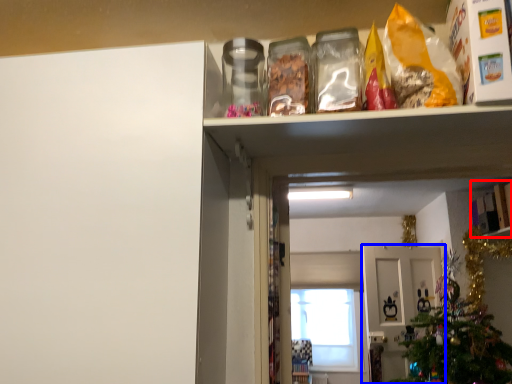
Question: Which object appears closest to the camera in this image, cabinet (highlighted by a red box) or door (highlighted by a blue box)?

Choices:
 (A) cabinet
 (B) door

Answer: (A)